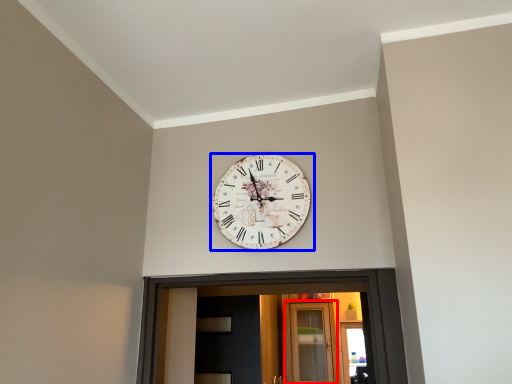
Question: Which of the following is the farthest to the observer, glass door (highlighted by a red box) or wall clock (highlighted by a blue box)?

Choices:
 (A) glass door
 (B) wall clock

Answer: (A)